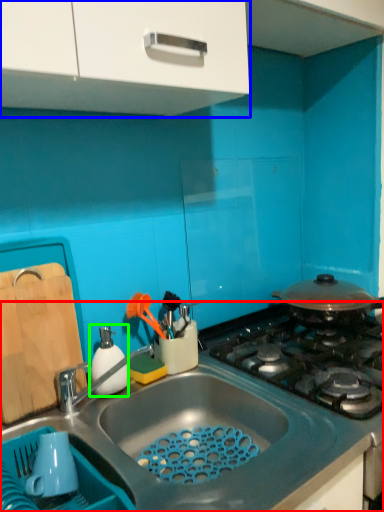
Question: Which object is the farthest from countertop (highlighted by a red box)? Choose among these: cabinetry (highlighted by a blue box) or appliance (highlighted by a green box).

Choices:
 (A) cabinetry
 (B) appliance

Answer: (A)